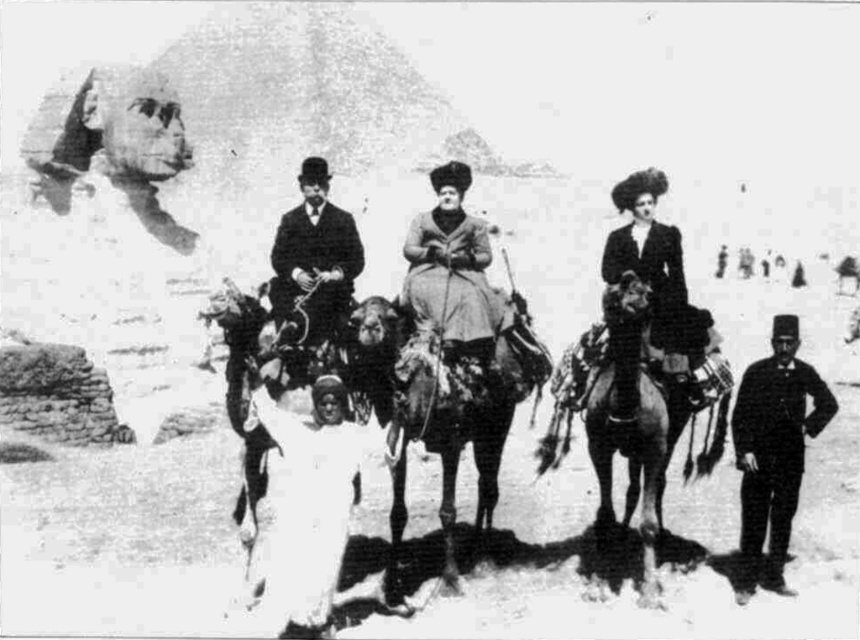
You are a photographer standing at the edge of the Giza Plateau, and you want to take a photo of the smooth brown horse at center and the white matte horse at center. The minimum distance required for your camera to focus on both subjects clearly is 5 meters. Will your camera be able to focus on both horses simultaneously?

The smooth brown horse at center and white matte horse at center are 4.96 meters apart from each other, which is less than the 5 meters required for the camera to focus clearly on both. Therefore, the camera may struggle to focus on both horses simultaneously.

Based on the photo, based on the scene description and the objects provided, can you determine the exact coordinates of the white matte horse at center?

The white matte horse at center is located at coordinates point (262, 378).